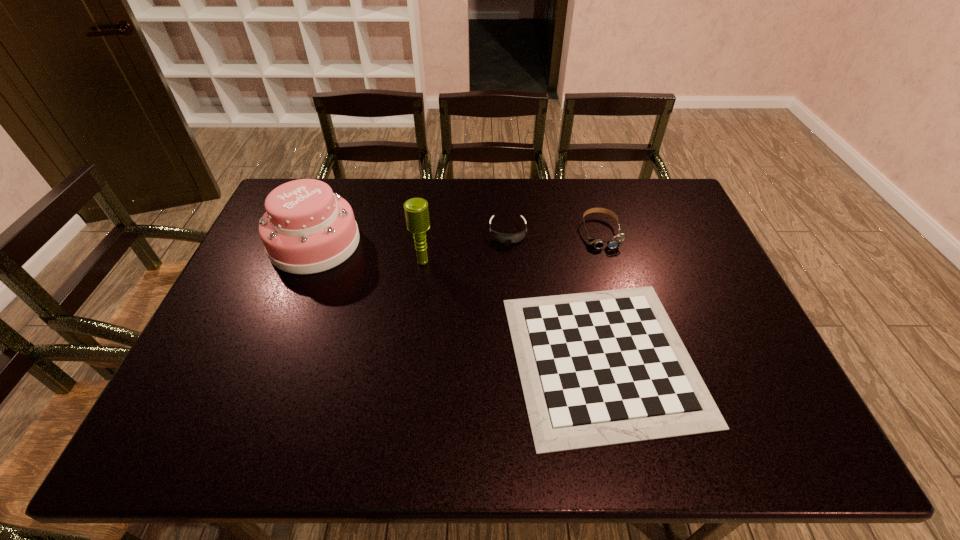
Where is `the fourth object from right to left`? The height and width of the screenshot is (540, 960). the fourth object from right to left is located at coordinates (416, 210).

Identify the location of the leftmost object. (306, 229).

This screenshot has width=960, height=540. In order to click on cake in this screenshot , I will do (306, 229).

Image resolution: width=960 pixels, height=540 pixels. What are the coordinates of `the third tallest object` in the screenshot? It's located at (616, 241).

Find the location of a particular element. the taller goggles is located at coordinates (616, 241).

Locate an element on the screen. This screenshot has width=960, height=540. the left goggles is located at coordinates (500, 237).

Find the location of a particular element. Image resolution: width=960 pixels, height=540 pixels. the second shortest object is located at coordinates (500, 237).

At what (x,y) coordinates should I click in order to perform the action: click on the shortest object. Please return your answer as a coordinate pair (x, y). The image size is (960, 540). Looking at the image, I should click on (600, 368).

Identify the location of chessboard. This screenshot has height=540, width=960. (600, 368).

The image size is (960, 540). Identify the location of free space located 0.200m on the back of the fourth object from right to left. (429, 213).